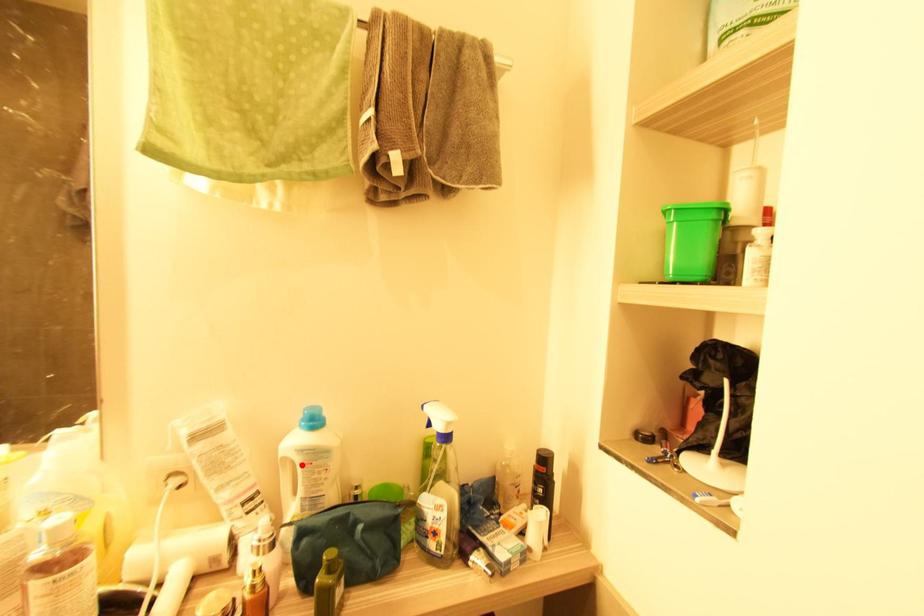
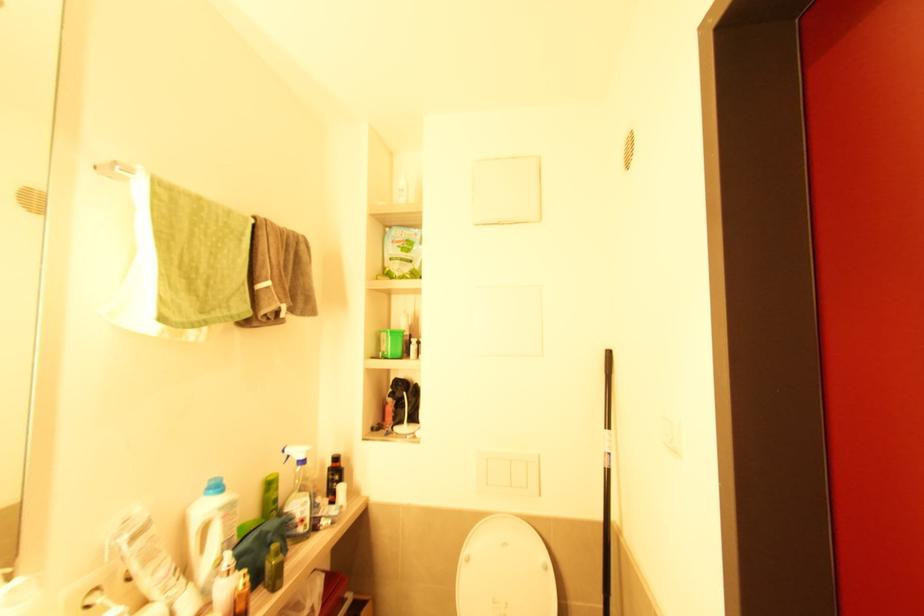
The point at the highlighted location is marked in the first image. Where is the corresponding point in the second image?

(224, 519)